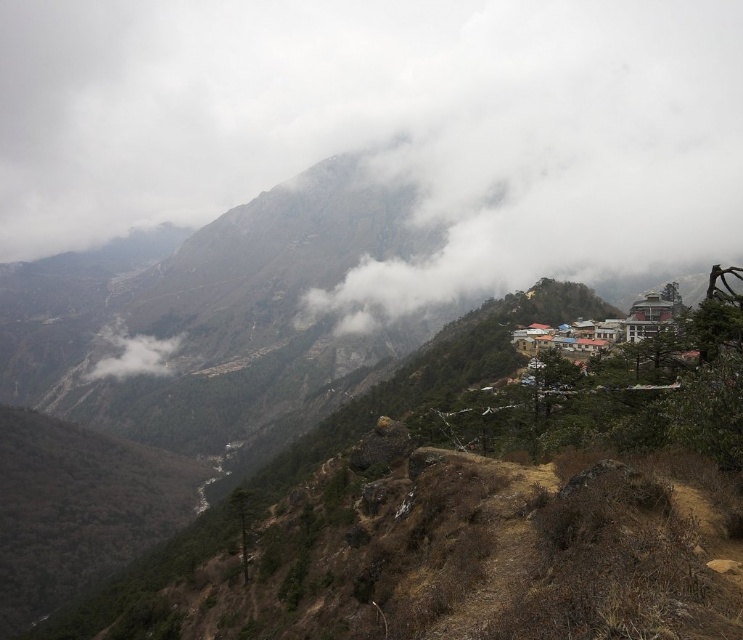
Is the position of white fluffy cloud at upper center less distant than that of white fluffy cloud at lower left?

Yes, it is.

Can you confirm if white fluffy cloud at upper center is thinner than white fluffy cloud at lower left?

In fact, white fluffy cloud at upper center might be wider than white fluffy cloud at lower left.

Which is behind, point (288, 4) or point (114, 342)?

The point (288, 4) is behind.

This screenshot has width=743, height=640. Find the location of `white fluffy cloud at upper center`. white fluffy cloud at upper center is located at coordinates (383, 125).